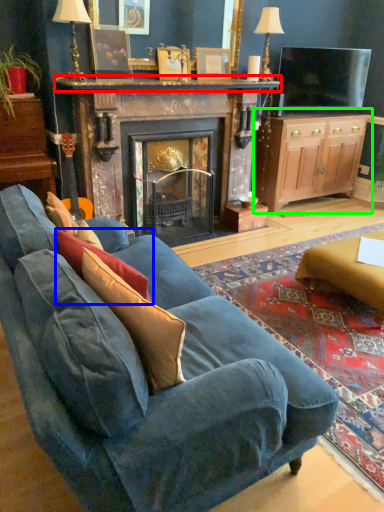
Question: Which object is the farthest from mantle (highlighted by a red box)? Choose among these: pillow (highlighted by a blue box) or cabinetry (highlighted by a green box).

Choices:
 (A) pillow
 (B) cabinetry

Answer: (A)